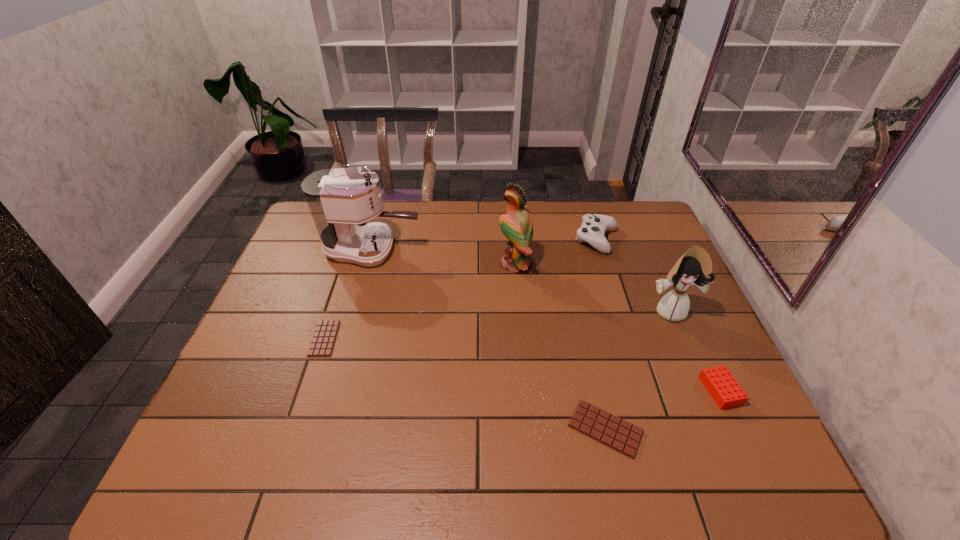
To achieve uniform spacing by inserting another candy_bar among them, please point to a free space for this new candy_bar. Please provide its 2D coordinates. Your answer should be formatted as a tuple, i.e. [(x, y)], where the tuple contains the x and y coordinates of a point satisfying the conditions above.

[(453, 380)]